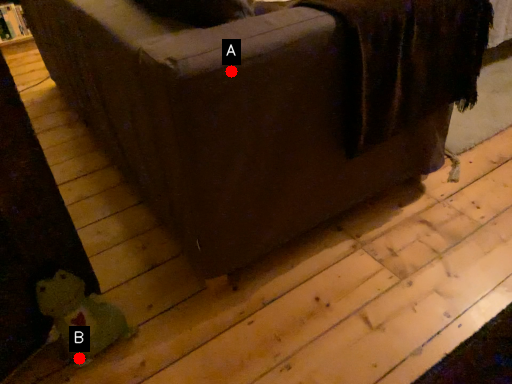
Question: Two points are circled on the image, labeled by A and B beside each circle. Which of the following is the farthest from the observer?

Choices:
 (A) A is further
 (B) B is further

Answer: (B)